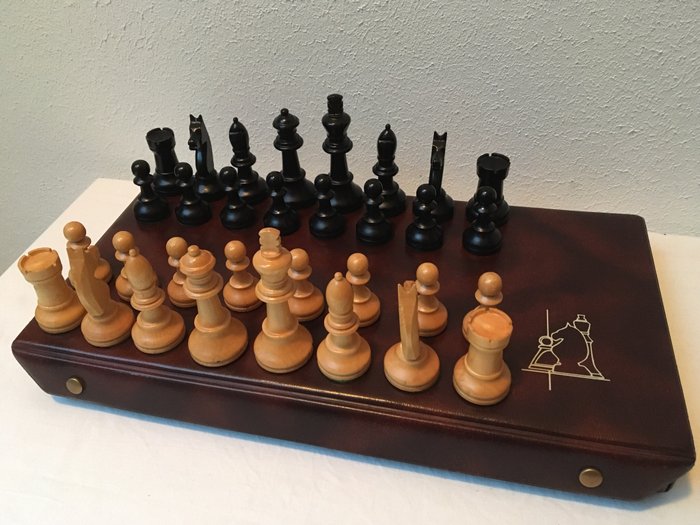
Image resolution: width=700 pixels, height=525 pixels. In order to click on wall in this screenshot , I will do `click(162, 30)`.